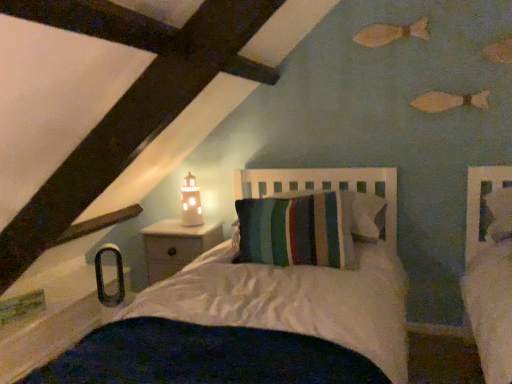
I want to click on vacant space in front of matte white lighthouse at upper center, so click(187, 233).